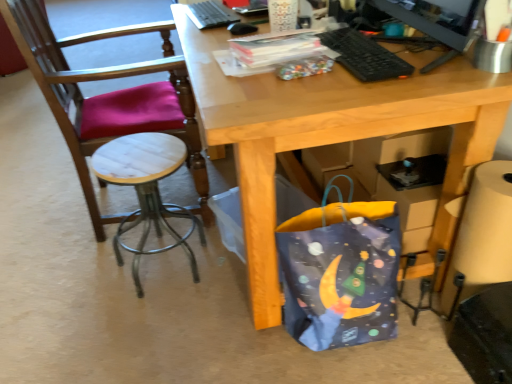
Question: Is there a large distance between white marble stool at left and black matte mouse at upper center?

Choices:
 (A) no
 (B) yes

Answer: (A)

Question: Is white marble stool at left to the right of black matte mouse at upper center from the viewer's perspective?

Choices:
 (A) yes
 (B) no

Answer: (B)

Question: Does white marble stool at left touch black matte mouse at upper center?

Choices:
 (A) no
 (B) yes

Answer: (A)

Question: From a real-world perspective, is white marble stool at left below black matte mouse at upper center?

Choices:
 (A) no
 (B) yes

Answer: (B)

Question: Considering the relative sizes of white marble stool at left and black matte mouse at upper center in the image provided, is white marble stool at left bigger than black matte mouse at upper center?

Choices:
 (A) no
 (B) yes

Answer: (B)

Question: Visually, is black matte mouse at upper center positioned to the left or to the right of black plastic keyboard at upper center, which is the 2th laptop keyboard from left to right?

Choices:
 (A) right
 (B) left

Answer: (B)

Question: Relative to black plastic keyboard at upper center, the 1th laptop keyboard from the right, is black matte mouse at upper center in front or behind?

Choices:
 (A) behind
 (B) front

Answer: (A)

Question: From a real-world perspective, relative to black plastic keyboard at upper center, which is the 2th laptop keyboard from left to right, is black matte mouse at upper center vertically above or below?

Choices:
 (A) below
 (B) above

Answer: (B)

Question: Does point (254, 26) appear closer or farther from the camera than point (354, 46)?

Choices:
 (A) farther
 (B) closer

Answer: (A)

Question: From the image's perspective, relative to white marble stool at left, is black plastic keyboard at upper center, the first laptop keyboard positioned from the back, above or below?

Choices:
 (A) above
 (B) below

Answer: (A)

Question: Looking at their shapes, would you say black plastic keyboard at upper center, which is counted as the first laptop keyboard, starting from the left, is wider or thinner than white marble stool at left?

Choices:
 (A) wide
 (B) thin

Answer: (B)

Question: From their relative heights in the image, would you say black plastic keyboard at upper center, arranged as the 2th laptop keyboard when viewed from the front, is taller or shorter than white marble stool at left?

Choices:
 (A) tall
 (B) short

Answer: (B)

Question: In terms of size, does black plastic keyboard at upper center, arranged as the 2th laptop keyboard when viewed from the front, appear bigger or smaller than white marble stool at left?

Choices:
 (A) big
 (B) small

Answer: (B)

Question: From a real-world perspective, is black plastic keyboard at upper center, the second laptop keyboard positioned from the top, above or below blue fabric bag at lower right?

Choices:
 (A) below
 (B) above

Answer: (B)

Question: Is black plastic keyboard at upper center, which is the 2th laptop keyboard from left to right, bigger or smaller than blue fabric bag at lower right?

Choices:
 (A) small
 (B) big

Answer: (A)